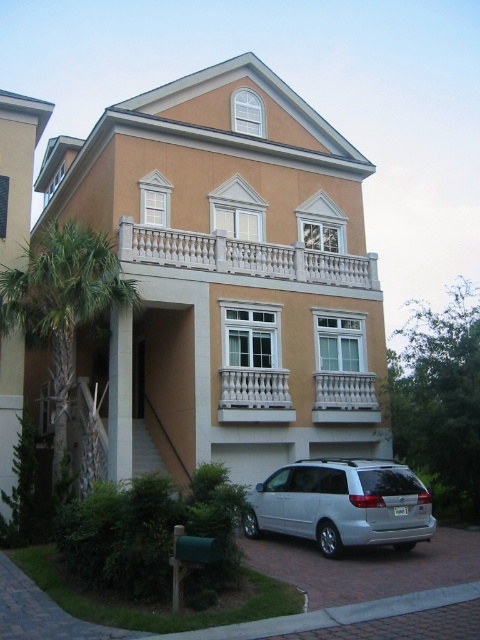
Question: Which object is the closest to the satin silver minivan at lower right?

Choices:
 (A) green leafy palm tree at left
 (B) white marble balustrade at center

Answer: (B)

Question: Does green leafy palm tree at left have a greater width compared to white marble balustrade at center?

Choices:
 (A) yes
 (B) no

Answer: (B)

Question: Can you confirm if green leafy palm tree at left is positioned below white marble balustrade at center?

Choices:
 (A) yes
 (B) no

Answer: (B)

Question: In this image, where is white stone balcony at upper center located relative to white marble balustrade at center?

Choices:
 (A) above
 (B) below

Answer: (A)

Question: Which is nearer to the white stone balcony at upper center?

Choices:
 (A) white marble balustrade at center
 (B) green leafy palm tree at left

Answer: (A)

Question: Estimate the real-world distances between objects in this image. Which object is closer to the satin silver minivan at lower right?

Choices:
 (A) white stone balcony at upper center
 (B) white marble balustrade at center

Answer: (B)